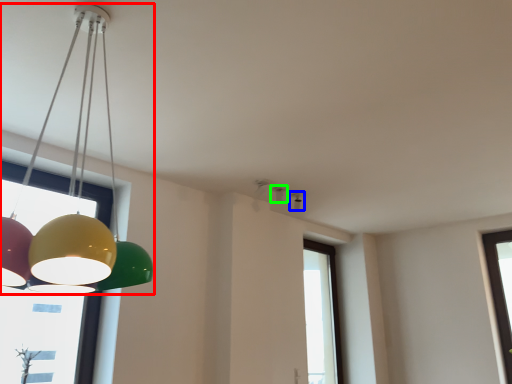
Question: Considering the real-world distances, which object is closest to lamp (highlighted by a red box)? lamp (highlighted by a blue box) or lamp (highlighted by a green box).

Choices:
 (A) lamp
 (B) lamp

Answer: (B)